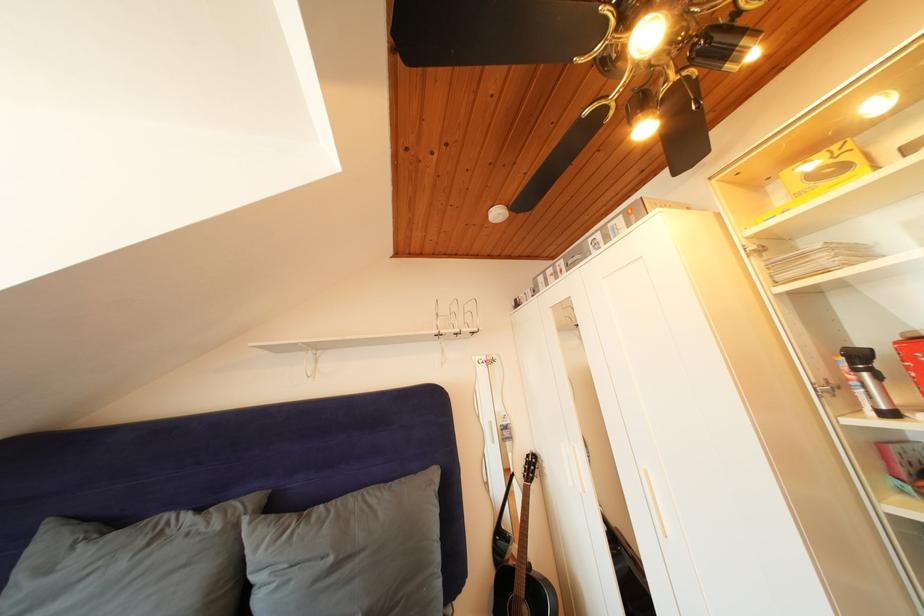
Where is `white smoke detector`? white smoke detector is located at coordinates [x=497, y=214].